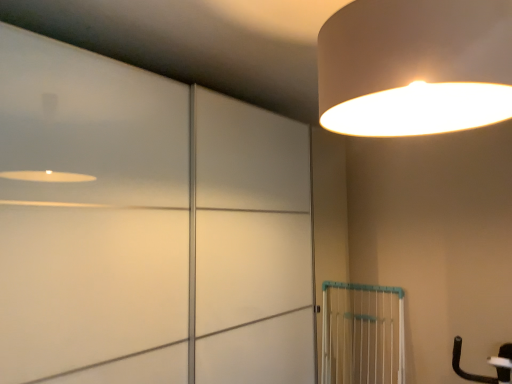
Question: Should I look upward or downward to see matte white lampshade at upper right?

Choices:
 (A) up
 (B) down

Answer: (A)

Question: Is white matte sliding door at upper left wider than white plastic gate at lower right?

Choices:
 (A) yes
 (B) no

Answer: (A)

Question: Considering the relative positions of white matte sliding door at upper left and white plastic gate at lower right in the image provided, is white matte sliding door at upper left to the left of white plastic gate at lower right from the viewer's perspective?

Choices:
 (A) yes
 (B) no

Answer: (A)

Question: From a real-world perspective, is white matte sliding door at upper left below white plastic gate at lower right?

Choices:
 (A) yes
 (B) no

Answer: (B)

Question: Is white matte sliding door at upper left to the right of white plastic gate at lower right from the viewer's perspective?

Choices:
 (A) yes
 (B) no

Answer: (B)

Question: Does white matte sliding door at upper left come in front of white plastic gate at lower right?

Choices:
 (A) yes
 (B) no

Answer: (A)

Question: Would you say white matte sliding door at upper left is a long distance from white plastic gate at lower right?

Choices:
 (A) no
 (B) yes

Answer: (B)

Question: Is white plastic gate at lower right positioned far away from white matte sliding door at upper left?

Choices:
 (A) no
 (B) yes

Answer: (B)

Question: Can you confirm if white plastic gate at lower right is smaller than white matte sliding door at upper left?

Choices:
 (A) no
 (B) yes

Answer: (B)

Question: Does white plastic gate at lower right have a lesser height compared to white matte sliding door at upper left?

Choices:
 (A) yes
 (B) no

Answer: (A)

Question: Is white plastic gate at lower right positioned behind white matte sliding door at upper left?

Choices:
 (A) yes
 (B) no

Answer: (A)

Question: Does white plastic gate at lower right lie in front of white matte sliding door at upper left?

Choices:
 (A) no
 (B) yes

Answer: (A)

Question: Is white plastic gate at lower right oriented away from white matte sliding door at upper left?

Choices:
 (A) yes
 (B) no

Answer: (A)

Question: From the image's perspective, is white plastic gate at lower right above matte white lampshade at upper right?

Choices:
 (A) yes
 (B) no

Answer: (B)